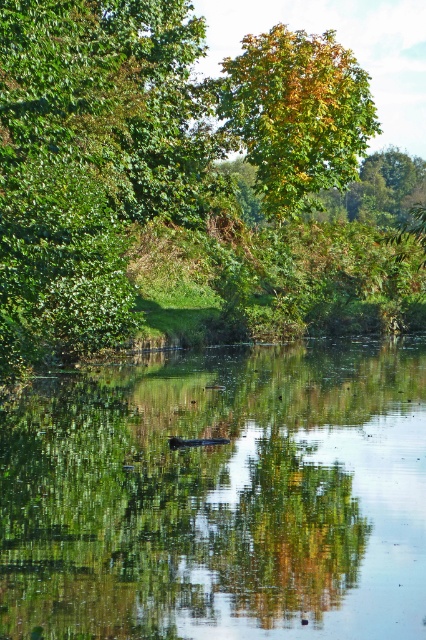
Question: In this image, where is green reflective water at center located relative to yellow-green leafy tree at upper center?

Choices:
 (A) right
 (B) left

Answer: (B)

Question: Which point is farther to the camera?

Choices:
 (A) yellow-green leafy tree at upper center
 (B) green reflective water at center
 (C) green leafy tree at center

Answer: (A)

Question: In this image, where is green leafy tree at center located relative to yellow-green leafy tree at upper center?

Choices:
 (A) above
 (B) below

Answer: (B)

Question: Does green leafy tree at center have a lesser width compared to green reflective water at center?

Choices:
 (A) yes
 (B) no

Answer: (B)

Question: Among these objects, which one is nearest to the camera?

Choices:
 (A) yellow-green leafy tree at upper center
 (B) green leafy tree at center
 (C) green reflective water at center

Answer: (C)

Question: Which point appears farthest from the camera in this image?

Choices:
 (A) (331, 404)
 (B) (305, 77)

Answer: (B)